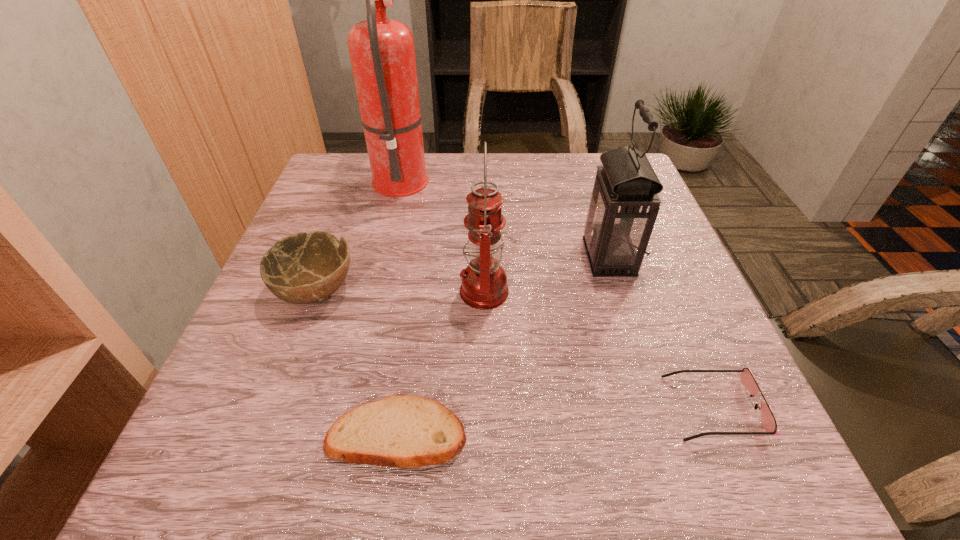
In order to click on fire extinguisher located in the left edge section of the desktop in this screenshot , I will do `click(382, 53)`.

Identify the location of bowl that is at the left edge. This screenshot has height=540, width=960. (302, 268).

You are a GUI agent. You are given a task and a screenshot of the screen. Output one action in this format:
    pyautogui.click(x=<x>, y=<y>)
    Task: Click on the lantern positioned at the right edge
    This screenshot has width=960, height=540.
    Given the screenshot: What is the action you would take?
    pyautogui.click(x=624, y=204)

Locate an element on the screen. The image size is (960, 540). sunglasses that is at the right edge is located at coordinates tap(768, 423).

In order to click on object that is at the far left corner in this screenshot , I will do `click(382, 53)`.

Locate an element on the screen. This screenshot has height=540, width=960. object positioned at the near right corner is located at coordinates (768, 423).

This screenshot has height=540, width=960. In the image, there is a desktop. In order to click on blank space at the far edge in this screenshot , I will do `click(571, 197)`.

Where is `free space at the left edge of the desktop`? The height and width of the screenshot is (540, 960). free space at the left edge of the desktop is located at coordinates (267, 369).

Where is `free space at the right edge of the desktop`? free space at the right edge of the desktop is located at coordinates (701, 376).

Identify the location of free space at the far left corner of the desktop. (366, 163).